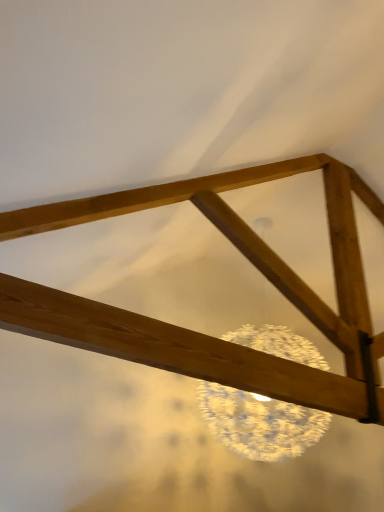
Identify the location of natural wood frame at upper center. (199, 333).

The width and height of the screenshot is (384, 512). What do you see at coordinates (199, 333) in the screenshot? I see `natural wood frame at upper center` at bounding box center [199, 333].

The height and width of the screenshot is (512, 384). I want to click on natural wood frame at upper center, so click(199, 333).